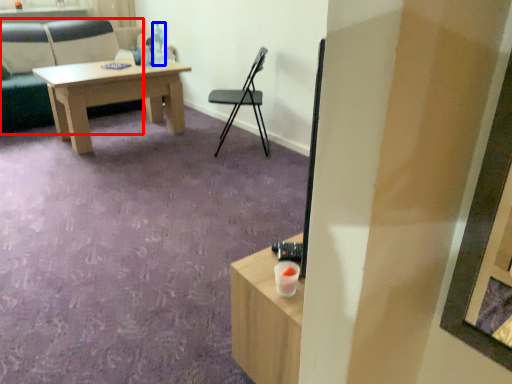
Question: Which object is closer to the camera taking this photo, chair (highlighted by a red box) or bottle (highlighted by a blue box)?

Choices:
 (A) chair
 (B) bottle

Answer: (A)